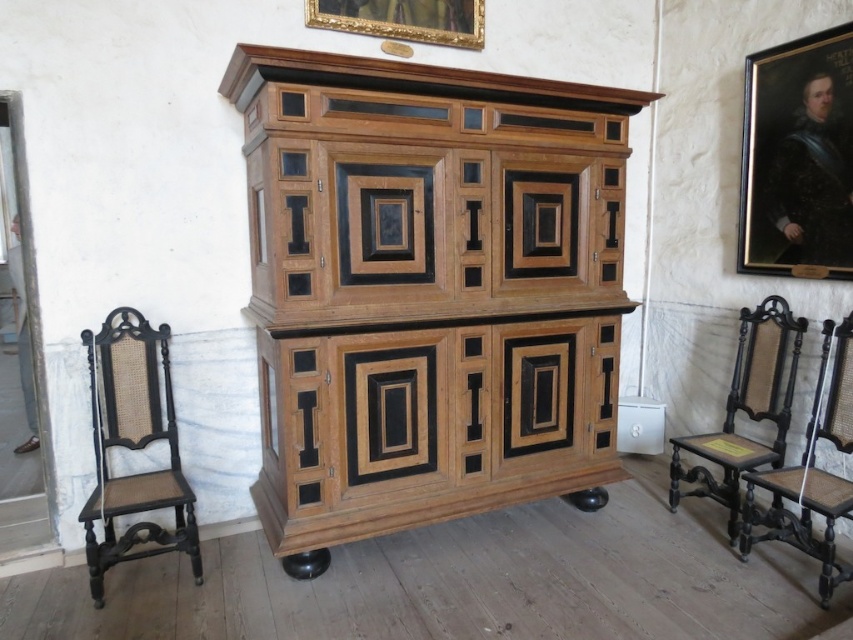
Question: Considering the real-world distances, which object is closest to the wooden portrait frame at upper right?

Choices:
 (A) goldmetallicpicture frame at upper center
 (B) natural wood armoire at center
 (C) black wood chair at left
 (D) black wood chair at right

Answer: (D)

Question: Which point is farther from the camera taking this photo?

Choices:
 (A) (764, 83)
 (B) (781, 442)
 (C) (759, 534)
 (D) (308, 12)

Answer: (A)

Question: Is natural wood armoire at center wider than goldmetallicpicture frame at upper center?

Choices:
 (A) yes
 (B) no

Answer: (A)

Question: Which object is closer to the camera taking this photo?

Choices:
 (A) dark wood chair at right
 (B) goldmetallicpicture frame at upper center

Answer: (A)

Question: Is dark wood chair at right below black wood chair at right?

Choices:
 (A) yes
 (B) no

Answer: (B)

Question: Can you confirm if natural wood armoire at center is positioned to the left of black wood chair at right?

Choices:
 (A) no
 (B) yes

Answer: (B)